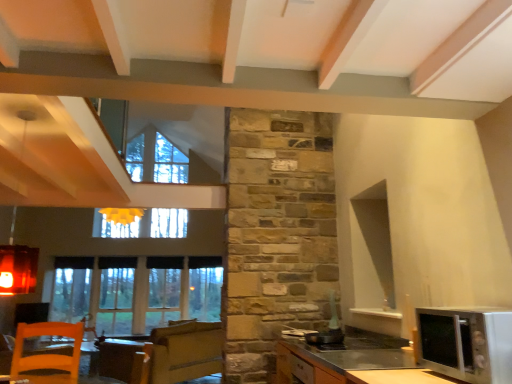
This screenshot has width=512, height=384. What do you see at coordinates (467, 343) in the screenshot?
I see `silver metallic microwave at lower right` at bounding box center [467, 343].

Describe the element at coordinates (136, 291) in the screenshot. I see `clear glass window at lower left` at that location.

What is the approximate width of satin silver microwave at lower right?

satin silver microwave at lower right is 27.22 inches wide.

Find the location of a particular element. orange wooden chair at lower left is located at coordinates (47, 354).

From the image's perspective, which is below, silver metallic microwave at lower right or orange wooden chair at lower left?

orange wooden chair at lower left appears lower in the image.

Is silver metallic microwave at lower right turned away from orange wooden chair at lower left?

No, silver metallic microwave at lower right is not facing away from orange wooden chair at lower left.

From a real-world perspective, is silver metallic microwave at lower right on top of orange wooden chair at lower left?

Yes, from a real-world perspective, silver metallic microwave at lower right is over orange wooden chair at lower left

At what (x,y) coordinates should I click in order to perform the action: click on microwave oven in front of the orange wooden chair at lower left. Please return your answer as a coordinate pair (x, y). The image size is (512, 384). Looking at the image, I should click on (467, 343).

Considering the sizes of objects satin silver microwave at lower right and clear glass window at lower left in the image provided, who is wider, satin silver microwave at lower right or clear glass window at lower left?

satin silver microwave at lower right is wider.

Which is closer to the camera, (377, 352) or (100, 273)?

Clearly, point (377, 352) is closer to the camera than point (100, 273).

In the image, is satin silver microwave at lower right on the left side or the right side of clear glass window at lower left?

Clearly, satin silver microwave at lower right is on the right of clear glass window at lower left in the image.

Would you say satin silver microwave at lower right is inside or outside clear glass window at lower left?

satin silver microwave at lower right is not inside clear glass window at lower left, it's outside.

Does clear glass window at lower left have a greater height compared to orange wooden chair at lower left?

Indeed, clear glass window at lower left has a greater height compared to orange wooden chair at lower left.

Find the location of a particular element. This screenshot has width=512, height=384. chair below the clear glass window at lower left (from a real-world perspective) is located at coordinates (47, 354).

From a real-world perspective, which is physically below, clear glass window at lower left or orange wooden chair at lower left?

orange wooden chair at lower left is physically lower.

From the image's perspective, which object appears higher, clear glass window at lower left or orange wooden chair at lower left?

From the image's view, orange wooden chair at lower left is above.

How distant is clear glass window at lower left from silver metallic microwave at lower right?

clear glass window at lower left and silver metallic microwave at lower right are 8.42 feet apart.

From a real-world perspective, is clear glass window at lower left above or below silver metallic microwave at lower right?

Clearly, from a real-world perspective, clear glass window at lower left is above silver metallic microwave at lower right.

From the image's perspective, is clear glass window at lower left located above silver metallic microwave at lower right?

No, from the image's perspective, clear glass window at lower left is not on top of silver metallic microwave at lower right.

Considering the relative sizes of clear glass window at lower left and silver metallic microwave at lower right in the image provided, is clear glass window at lower left wider than silver metallic microwave at lower right?

No.

Are orange wooden chair at lower left and satin silver microwave at lower right located far from each other?

Yes, orange wooden chair at lower left is far from satin silver microwave at lower right.

Considering the relative positions of orange wooden chair at lower left and satin silver microwave at lower right in the image provided, is orange wooden chair at lower left to the left of satin silver microwave at lower right from the viewer's perspective?

Yes, orange wooden chair at lower left is to the left of satin silver microwave at lower right.

From the image's perspective, is orange wooden chair at lower left above satin silver microwave at lower right?

No.

Based on their positions, is satin silver microwave at lower right located to the left or right of orange wooden chair at lower left?

Clearly, satin silver microwave at lower right is on the right of orange wooden chair at lower left in the image.

Is satin silver microwave at lower right far away from orange wooden chair at lower left?

Absolutely, satin silver microwave at lower right is distant from orange wooden chair at lower left.

Between satin silver microwave at lower right and orange wooden chair at lower left, which one is positioned in front?

satin silver microwave at lower right is more forward.

Between satin silver microwave at lower right and orange wooden chair at lower left, which one has more height?

orange wooden chair at lower left is taller.

From a real-world perspective, is orange wooden chair at lower left over clear glass window at lower left?

No, from a real-world perspective, orange wooden chair at lower left is not above clear glass window at lower left.

Which object is thinner, orange wooden chair at lower left or clear glass window at lower left?

Thinner between the two is clear glass window at lower left.

Is orange wooden chair at lower left inside the boundaries of clear glass window at lower left, or outside?

orange wooden chair at lower left is outside clear glass window at lower left.

From the image's perspective, between orange wooden chair at lower left and clear glass window at lower left, who is located below?

From the image's view, clear glass window at lower left is below.

Locate an element on the screen. chair below the silver metallic microwave at lower right (from the image's perspective) is located at coordinates (47, 354).

I want to click on cabinetry in front of the clear glass window at lower left, so click(345, 363).

Based on their spatial positions, is clear glass window at lower left or satin silver microwave at lower right closer to silver metallic microwave at lower right?

satin silver microwave at lower right is positioned closer to the anchor silver metallic microwave at lower right.

Considering their positions, is orange wooden chair at lower left positioned further to satin silver microwave at lower right than clear glass window at lower left?

orange wooden chair at lower left is further to satin silver microwave at lower right.

From the picture: Estimate the real-world distances between objects in this image. Which object is further from silver metallic microwave at lower right, satin silver microwave at lower right or orange wooden chair at lower left?

orange wooden chair at lower left lies further to silver metallic microwave at lower right than the other object.

From the image, which object appears to be nearer to orange wooden chair at lower left, silver metallic microwave at lower right or satin silver microwave at lower right?

satin silver microwave at lower right.

Considering their positions, is clear glass window at lower left positioned further to silver metallic microwave at lower right than orange wooden chair at lower left?

The object further to silver metallic microwave at lower right is clear glass window at lower left.

From the image, which object appears to be nearer to clear glass window at lower left, silver metallic microwave at lower right or satin silver microwave at lower right?

satin silver microwave at lower right.

Considering their positions, is silver metallic microwave at lower right positioned further to satin silver microwave at lower right than clear glass window at lower left?

Among the two, clear glass window at lower left is located further to satin silver microwave at lower right.

Which object lies nearer to the anchor point silver metallic microwave at lower right, orange wooden chair at lower left or satin silver microwave at lower right?

satin silver microwave at lower right lies closer to silver metallic microwave at lower right than the other object.

Locate an element on the screen. The width and height of the screenshot is (512, 384). cabinetry between silver metallic microwave at lower right and clear glass window at lower left along the z-axis is located at coordinates (345, 363).

Where is `chair between satin silver microwave at lower right and clear glass window at lower left from front to back`? chair between satin silver microwave at lower right and clear glass window at lower left from front to back is located at coordinates (47, 354).

Locate an element on the screen. cabinetry between orange wooden chair at lower left and silver metallic microwave at lower right in the horizontal direction is located at coordinates (345, 363).

Locate an element on the screen. chair located between silver metallic microwave at lower right and clear glass window at lower left in the depth direction is located at coordinates (47, 354).